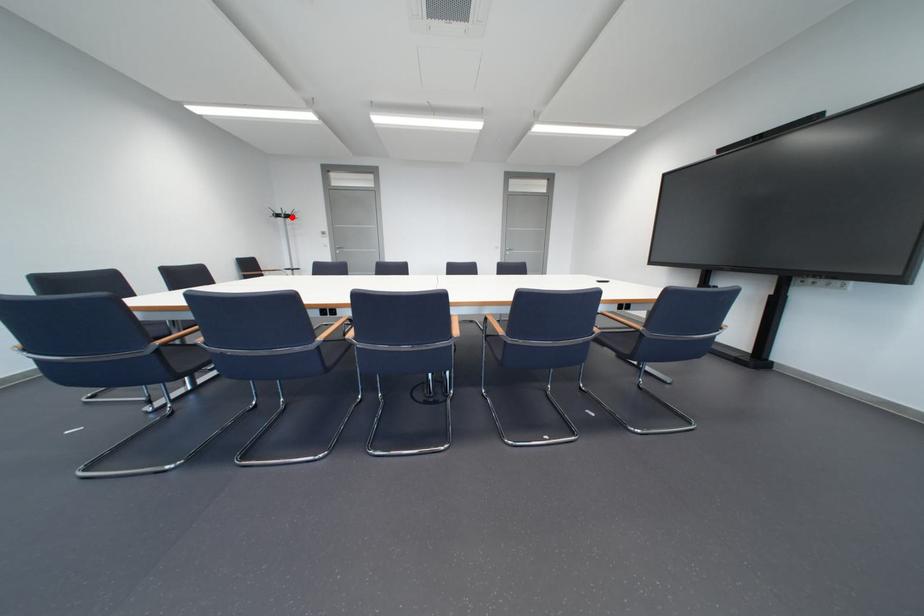
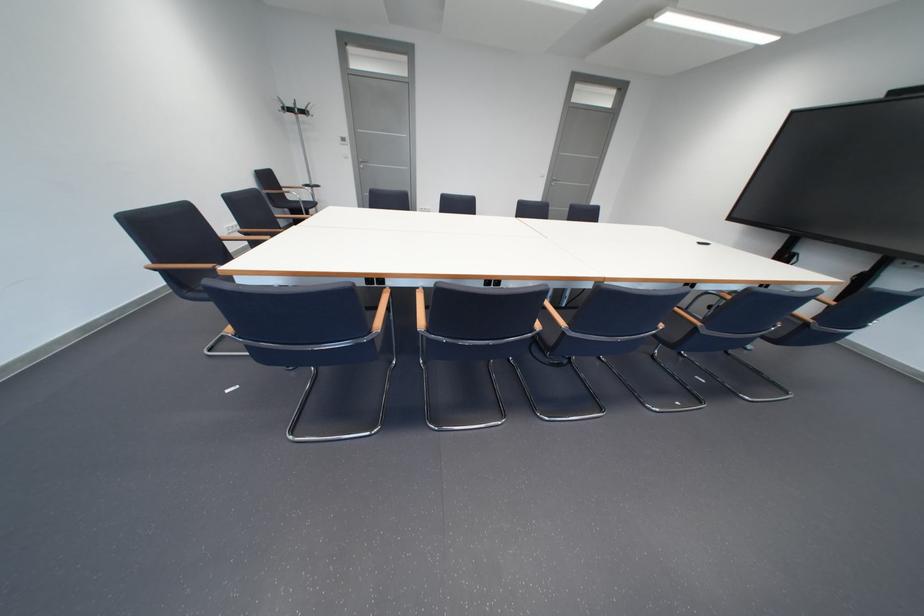
Question: I am providing you with two images of the same scene from different viewpoints. A red point is shown in image1. For the corresponding object point in image2, is it positioned nearer or farther from the camera?

Choices:
 (A) Nearer
 (B) Farther

Answer: (B)